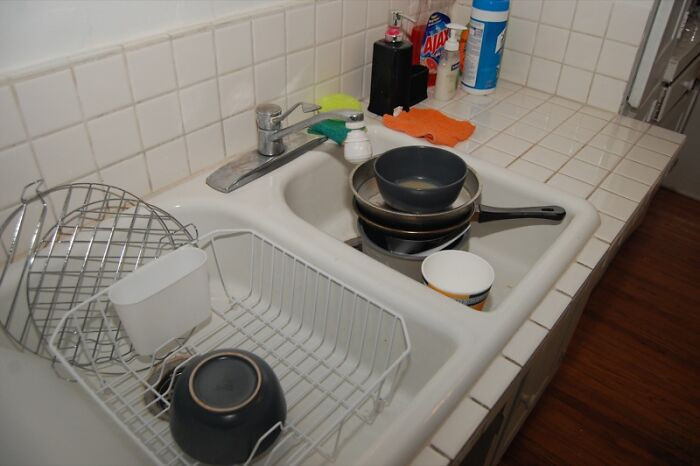
Locate an element on the screen. The image size is (700, 466). pot is located at coordinates coord(500,215).